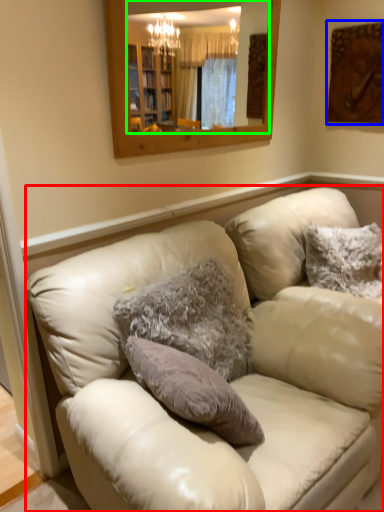
Question: Which object is positioned closest to studio couch (highlighted by a red box)? Select from picture frame (highlighted by a blue box) and mirror (highlighted by a green box).

Choices:
 (A) picture frame
 (B) mirror

Answer: (A)